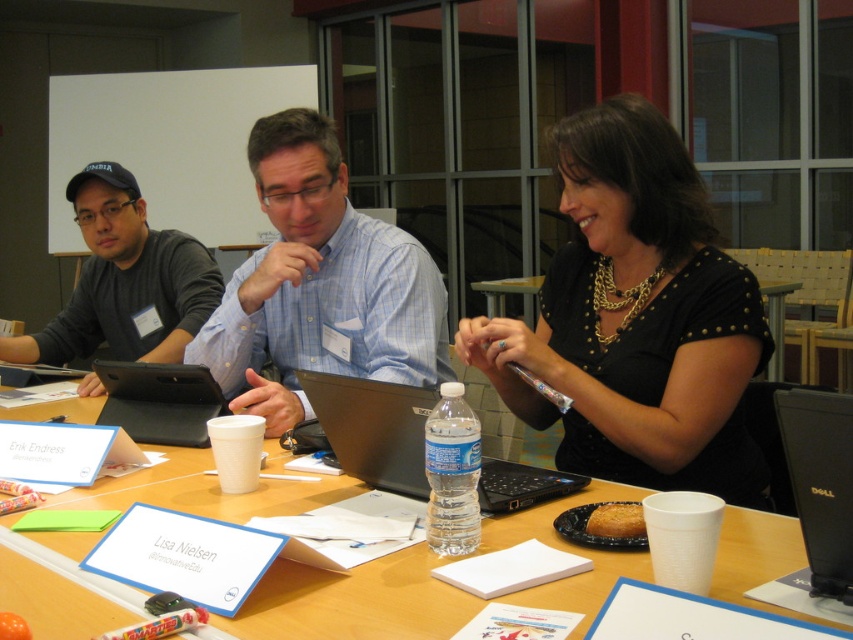
Question: Where is matte black shirt at left located in relation to black plastic computer at lower right in the image?

Choices:
 (A) below
 (B) above

Answer: (B)

Question: Which object is farther from the camera taking this photo?

Choices:
 (A) matte black shirt at left
 (B) black matte table at center
 (C) wooden table at center
 (D) blue plaid shirt at center

Answer: (B)

Question: Which object is positioned closest to the black matte tablet at center?

Choices:
 (A) black studded blouse at center
 (B) wooden table at center

Answer: (B)

Question: Among these objects, which one is farthest from the camera?

Choices:
 (A) blue plaid shirt at center
 (B) black studded blouse at center
 (C) black matte tablet at center
 (D) clear plastic water bottle at center

Answer: (C)

Question: Can you confirm if blue plaid shirt at center is positioned below matte black shirt at left?

Choices:
 (A) no
 (B) yes

Answer: (B)

Question: Is wooden table at center below blue plaid shirt at center?

Choices:
 (A) no
 (B) yes

Answer: (B)